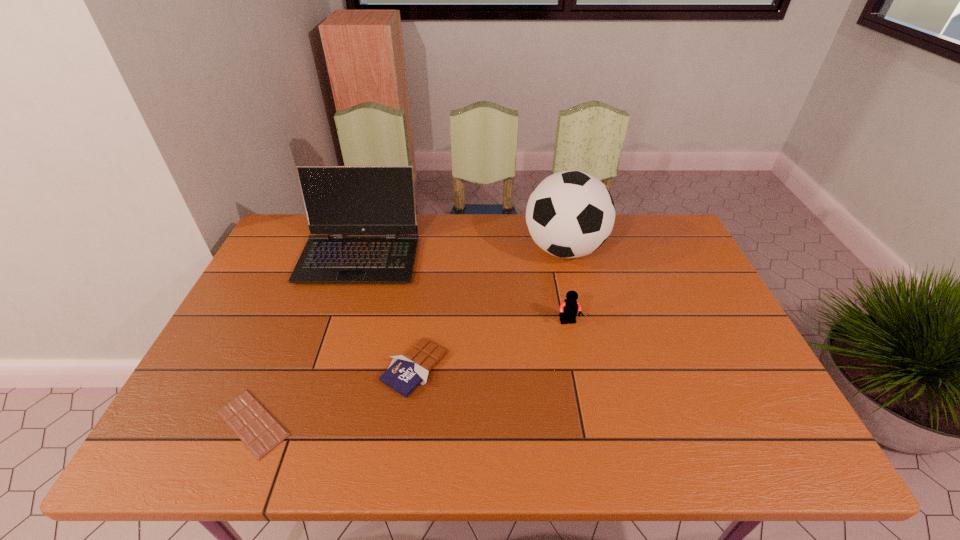
What are the coordinates of `empty location between the shortest object and the soccer ball` in the screenshot? It's located at (409, 336).

The height and width of the screenshot is (540, 960). What are the coordinates of `free space between the right chocolate bar and the laptop computer` in the screenshot? It's located at (387, 313).

This screenshot has height=540, width=960. I want to click on empty location between the soccer ball and the left chocolate bar, so click(409, 336).

This screenshot has height=540, width=960. I want to click on object that is the closest to the laptop computer, so click(405, 373).

Identify which object is the closest to the laptop computer. Please provide its 2D coordinates. Your answer should be formatted as a tuple, i.e. [(x, y)], where the tuple contains the x and y coordinates of a point satisfying the conditions above.

[(405, 373)]

Image resolution: width=960 pixels, height=540 pixels. I want to click on free space that satisfies the following two spatial constraints: 1. on the screen of the fourth tallest object; 2. on the left side of the laptop computer, so click(324, 368).

At what (x,y) coordinates should I click in order to perform the action: click on free space that satisfies the following two spatial constraints: 1. on the screen of the right chocolate bar; 2. on the left side of the laptop computer. Please return your answer as a coordinate pair (x, y). Looking at the image, I should click on (324, 368).

At what (x,y) coordinates should I click in order to perform the action: click on vacant space that satisfies the following two spatial constraints: 1. on the screen of the laptop computer; 2. on the right side of the fourth tallest object. Please return your answer as a coordinate pair (x, y). Looking at the image, I should click on (324, 368).

Find the location of a particular element. The image size is (960, 540). vacant point that satisfies the following two spatial constraints: 1. on the back side of the soccer ball; 2. on the left side of the taller chocolate bar is located at coordinates (431, 249).

In order to click on free space that satisfies the following two spatial constraints: 1. on the back side of the right chocolate bar; 2. on the left side of the soccer ball in this screenshot , I will do `click(431, 249)`.